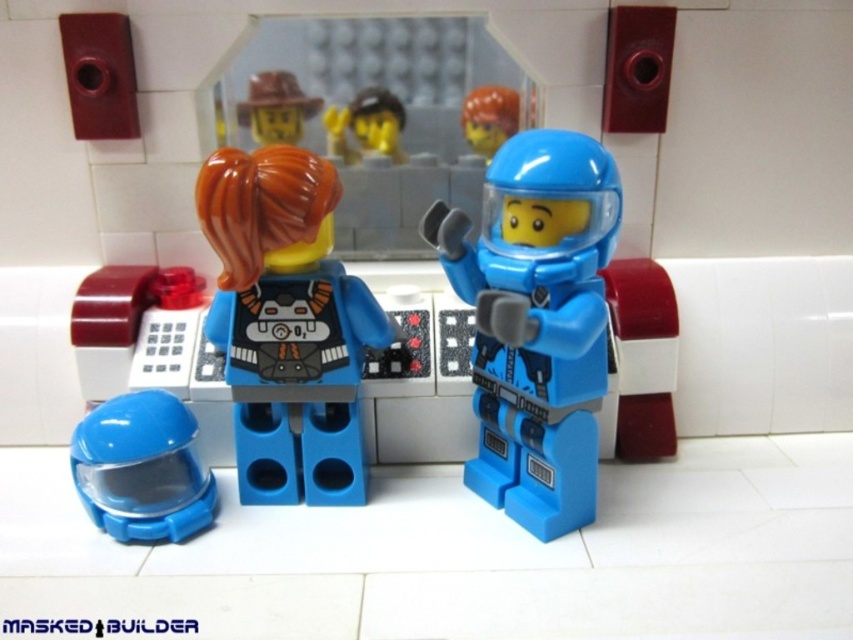
Between translucent orange hair at center and matte yellow helmet at upper center, which one has more height?

Standing taller between the two is translucent orange hair at center.

Which of these two, translucent orange hair at center or matte yellow helmet at upper center, stands shorter?

matte yellow helmet at upper center is shorter.

You are a GUI agent. You are given a task and a screenshot of the screen. Output one action in this format:
    pyautogui.click(x=<x>, y=<y>)
    Task: Click on the translucent orange hair at center
    The image size is (853, 640).
    Given the screenshot: What is the action you would take?
    pyautogui.click(x=287, y=324)

Where is `translucent orange hair at center`? Image resolution: width=853 pixels, height=640 pixels. translucent orange hair at center is located at coordinates (287, 324).

Is translucent orange hair at center above smooth yellow helmet at center?

No.

Does translucent orange hair at center have a lesser height compared to smooth yellow helmet at center?

In fact, translucent orange hair at center may be taller than smooth yellow helmet at center.

Which is in front, point (357, 296) or point (495, 88)?

Positioned in front is point (357, 296).

This screenshot has height=640, width=853. Identify the location of translucent orange hair at center. (287, 324).

Between blue plastic helmet at lower left and matte yellow helmet at upper center, which one appears on the left side from the viewer's perspective?

Positioned to the left is blue plastic helmet at lower left.

Does blue plastic helmet at lower left appear over matte yellow helmet at upper center?

Actually, blue plastic helmet at lower left is below matte yellow helmet at upper center.

Image resolution: width=853 pixels, height=640 pixels. Identify the location of blue plastic helmet at lower left. (141, 468).